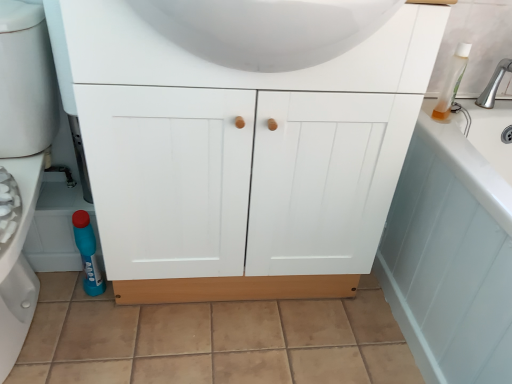
Question: Does light blue wood bath at lower right turn towards white matte cabinet at center?

Choices:
 (A) no
 (B) yes

Answer: (B)

Question: Can you confirm if light blue wood bath at lower right is thinner than white matte cabinet at center?

Choices:
 (A) no
 (B) yes

Answer: (A)

Question: Is light blue wood bath at lower right positioned with its back to white matte cabinet at center?

Choices:
 (A) no
 (B) yes

Answer: (A)

Question: Is white matte cabinet at center completely or partially inside light blue wood bath at lower right?

Choices:
 (A) yes
 (B) no

Answer: (B)

Question: Can you confirm if light blue wood bath at lower right is positioned to the right of white matte cabinet at center?

Choices:
 (A) yes
 (B) no

Answer: (A)

Question: Choose the correct answer: Is white matte cabinet at center inside blue glossy cleaner bottle at lower left or outside it?

Choices:
 (A) inside
 (B) outside

Answer: (B)

Question: From a real-world perspective, is white matte cabinet at center physically located above or below blue glossy cleaner bottle at lower left?

Choices:
 (A) above
 (B) below

Answer: (A)

Question: Relative to blue glossy cleaner bottle at lower left, is white matte cabinet at center in front or behind?

Choices:
 (A) front
 (B) behind

Answer: (B)

Question: Based on their positions, is white matte cabinet at center located to the left or right of blue glossy cleaner bottle at lower left?

Choices:
 (A) left
 (B) right

Answer: (B)

Question: Based on their positions, is translucent plastic bottle at upper right located to the left or right of white matte cabinet at center?

Choices:
 (A) right
 (B) left

Answer: (A)

Question: Which is correct: translucent plastic bottle at upper right is inside white matte cabinet at center, or outside of it?

Choices:
 (A) inside
 (B) outside

Answer: (B)

Question: From the image's perspective, is translucent plastic bottle at upper right located above or below white matte cabinet at center?

Choices:
 (A) below
 (B) above

Answer: (B)

Question: In the image, is translucent plastic bottle at upper right positioned in front of or behind white matte cabinet at center?

Choices:
 (A) behind
 (B) front

Answer: (A)

Question: Based on their sizes in the image, would you say brushed metal faucet at upper right is bigger or smaller than light blue wood bath at lower right?

Choices:
 (A) small
 (B) big

Answer: (A)

Question: Considering the positions of brushed metal faucet at upper right and light blue wood bath at lower right in the image, is brushed metal faucet at upper right wider or thinner than light blue wood bath at lower right?

Choices:
 (A) wide
 (B) thin

Answer: (B)